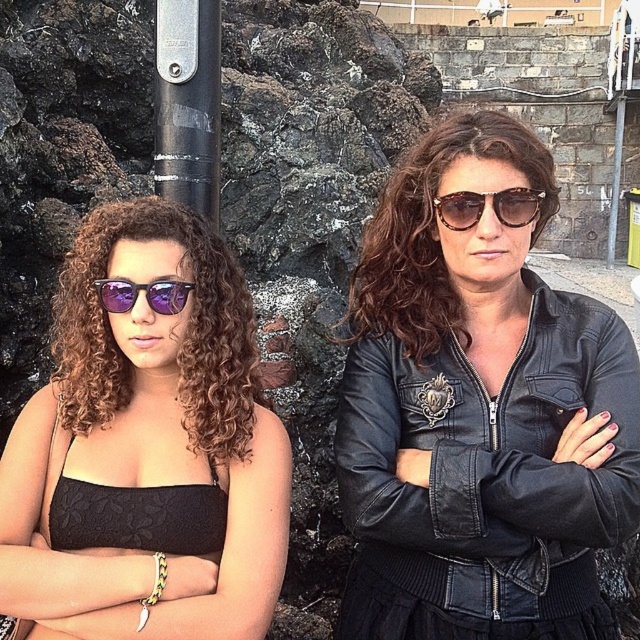
Question: Which of the following is the closest to the observer?

Choices:
 (A) (81, 372)
 (B) (216, 273)
 (C) (492, 632)
 (D) (218, 177)

Answer: (A)

Question: Does matte black top at center have a lesser width compared to sunglasses at center?

Choices:
 (A) yes
 (B) no

Answer: (B)

Question: Does black metallic pole at upper center appear over sunglasses at center?

Choices:
 (A) no
 (B) yes

Answer: (B)

Question: Which is farther from the black leather jacket at center?

Choices:
 (A) black metallic pole at upper center
 (B) sunglasses at center
 (C) purple reflective sunglasses at left
 (D) brown curly hair at left

Answer: (A)

Question: Which point is farther from the camera taking this photo?

Choices:
 (A) (538, 209)
 (B) (49, 531)
 (C) (548, 289)

Answer: (C)

Question: Can you confirm if matte black top at center is wider than leather jacket at center?

Choices:
 (A) yes
 (B) no

Answer: (A)